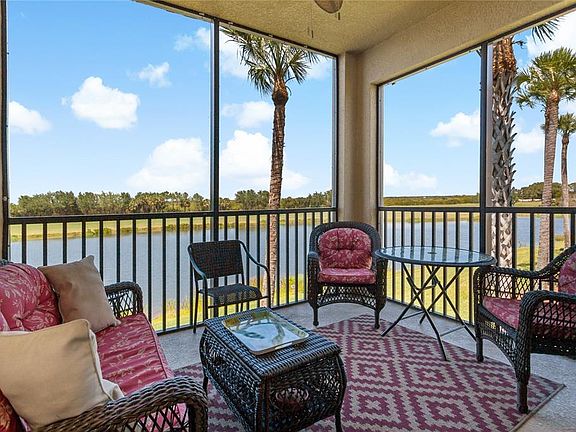
In order to click on couch in this screenshot , I will do `click(150, 401)`.